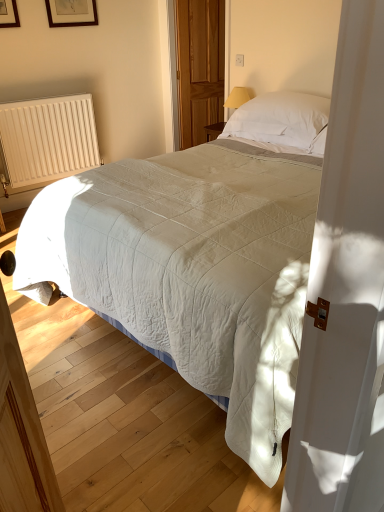
Question: Is wooden screen door at center smaller than wooden picture frame at upper left?

Choices:
 (A) yes
 (B) no

Answer: (B)

Question: From a real-world perspective, is wooden screen door at center physically below wooden picture frame at upper left?

Choices:
 (A) yes
 (B) no

Answer: (A)

Question: Is the surface of wooden screen door at center in direct contact with wooden picture frame at upper left?

Choices:
 (A) no
 (B) yes

Answer: (A)

Question: Considering the relative positions of wooden screen door at center and wooden picture frame at upper left in the image provided, is wooden screen door at center behind wooden picture frame at upper left?

Choices:
 (A) yes
 (B) no

Answer: (A)

Question: Does wooden screen door at center come in front of wooden picture frame at upper left?

Choices:
 (A) yes
 (B) no

Answer: (B)

Question: In the image, is wooden picture frame at upper left positioned in front of or behind white quilted bed at center?

Choices:
 (A) behind
 (B) front

Answer: (A)

Question: Considering the positions of wooden picture frame at upper left and white quilted bed at center in the image, is wooden picture frame at upper left wider or thinner than white quilted bed at center?

Choices:
 (A) thin
 (B) wide

Answer: (A)

Question: From the image's perspective, relative to white quilted bed at center, is wooden picture frame at upper left above or below?

Choices:
 (A) below
 (B) above

Answer: (B)

Question: In terms of size, does wooden picture frame at upper left appear bigger or smaller than white quilted bed at center?

Choices:
 (A) small
 (B) big

Answer: (A)

Question: Would you say white soft pillow at upper center is inside or outside wooden screen door at center?

Choices:
 (A) inside
 (B) outside

Answer: (B)

Question: In the image, is white soft pillow at upper center positioned in front of or behind wooden screen door at center?

Choices:
 (A) front
 (B) behind

Answer: (A)

Question: From the image's perspective, is white soft pillow at upper center located above or below wooden screen door at center?

Choices:
 (A) below
 (B) above

Answer: (A)

Question: In terms of width, does white soft pillow at upper center look wider or thinner when compared to wooden screen door at center?

Choices:
 (A) thin
 (B) wide

Answer: (B)

Question: In terms of width, does white ribbed radiator at left look wider or thinner when compared to white soft pillow at upper center?

Choices:
 (A) thin
 (B) wide

Answer: (A)

Question: From a real-world perspective, is white ribbed radiator at left physically located above or below white soft pillow at upper center?

Choices:
 (A) below
 (B) above

Answer: (A)